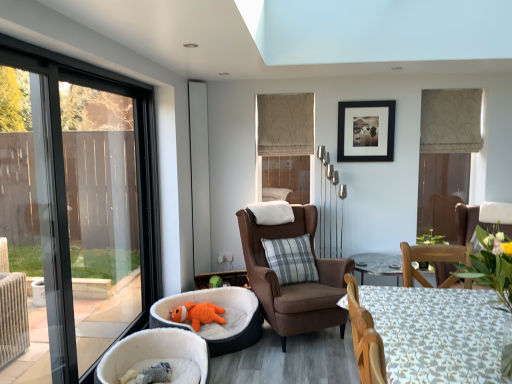
Question: Should I look upward or downward to see satin silver screen door at center?

Choices:
 (A) down
 (B) up

Answer: (B)

Question: Is white fabric table at lower right turned away from white plush pet bed at lower left, which ranks as the 2th chair in back-to-front order?

Choices:
 (A) yes
 (B) no

Answer: (B)

Question: Could white plush pet bed at lower left, positioned as the 1th chair in left-to-right order, be considered to be inside white fabric table at lower right?

Choices:
 (A) no
 (B) yes

Answer: (A)

Question: Is white fabric table at lower right taller than white plush pet bed at lower left, placed as the 1th chair when sorted from front to back?

Choices:
 (A) yes
 (B) no

Answer: (A)

Question: Does white fabric table at lower right appear on the left side of white plush pet bed at lower left, which ranks as the 2th chair in back-to-front order?

Choices:
 (A) no
 (B) yes

Answer: (A)

Question: From the image's perspective, is white fabric table at lower right on white plush pet bed at lower left, the second chair when ordered from right to left?

Choices:
 (A) yes
 (B) no

Answer: (A)

Question: Is white fabric table at lower right further to the viewer compared to white plush pet bed at lower left, placed as the 1th chair when sorted from front to back?

Choices:
 (A) yes
 (B) no

Answer: (B)

Question: From the image's perspective, is white plush pet bed at lower left, which ranks as the 2th chair in back-to-front order, over orange corduroy pet bed at lower left?

Choices:
 (A) no
 (B) yes

Answer: (A)

Question: Is white plush pet bed at lower left, positioned as the 1th chair in left-to-right order, outside of orange corduroy pet bed at lower left?

Choices:
 (A) no
 (B) yes

Answer: (B)

Question: From the image's perspective, would you say white plush pet bed at lower left, placed as the 1th chair when sorted from front to back, is shown under orange corduroy pet bed at lower left?

Choices:
 (A) yes
 (B) no

Answer: (A)

Question: Does white plush pet bed at lower left, which ranks as the 2th chair in back-to-front order, have a smaller size compared to orange corduroy pet bed at lower left?

Choices:
 (A) yes
 (B) no

Answer: (A)

Question: From a real-world perspective, is white plush pet bed at lower left, positioned as the 1th chair in left-to-right order, on orange corduroy pet bed at lower left?

Choices:
 (A) yes
 (B) no

Answer: (B)

Question: Is satin silver screen door at center positioned far away from white fabric table at lower right?

Choices:
 (A) yes
 (B) no

Answer: (A)